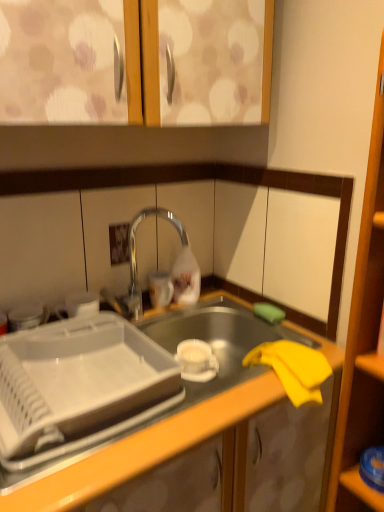
Question: Relative to polished chrome tap at center, is transparent plastic shelf at lower right in front or behind?

Choices:
 (A) behind
 (B) front

Answer: (B)

Question: From the image's perspective, is transparent plastic shelf at lower right above or below polished chrome tap at center?

Choices:
 (A) above
 (B) below

Answer: (B)

Question: Which object is positioned closest to the polished chrome tap at center?

Choices:
 (A) white plastic tray at center
 (B) matte wood cabinet doors at upper center
 (C) transparent plastic shelf at lower right
 (D) yellow fabric at lower right

Answer: (A)

Question: Which object is positioned farthest from the yellow fabric at lower right?

Choices:
 (A) white plastic tray at center
 (B) transparent plastic shelf at lower right
 (C) matte wood cabinet doors at upper center
 (D) polished chrome tap at center

Answer: (C)